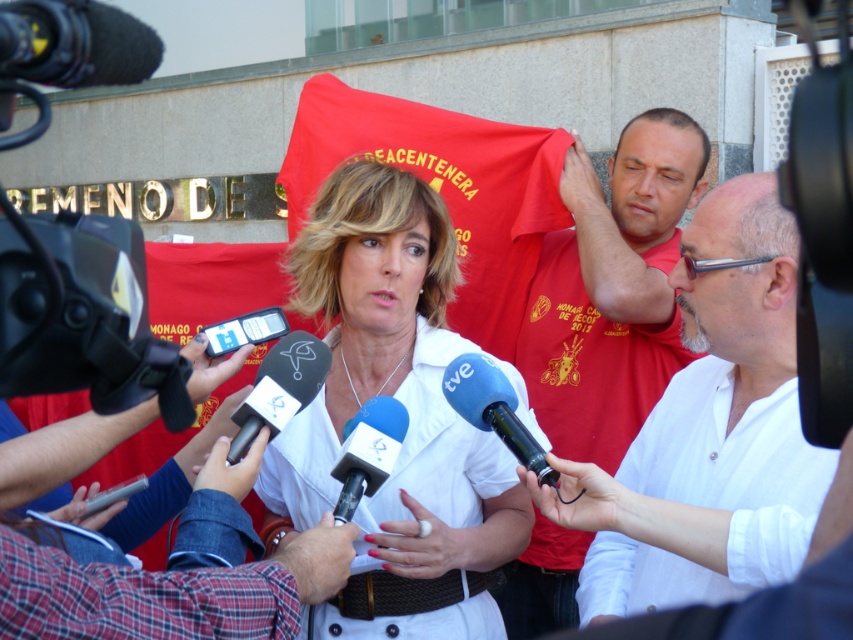
Between point (517, 196) and point (474, 356), which one is positioned behind?

Positioned behind is point (517, 196).

Does point (316, 176) come closer to viewer compared to point (479, 358)?

No, it is not.

Image resolution: width=853 pixels, height=640 pixels. I want to click on red fabric flag at center, so click(444, 188).

Does blue rubberized microphone at center appear on the right side of black plastic media at center?

Correct, you'll find blue rubberized microphone at center to the right of black plastic media at center.

Does blue rubberized microphone at center come in front of black plastic media at center?

Yes, blue rubberized microphone at center is closer to the viewer.

This screenshot has height=640, width=853. Find the location of `blue rubberized microphone at center`. blue rubberized microphone at center is located at coordinates (492, 410).

Between point (384, 636) and point (285, 321), which one is positioned behind?

Point (285, 321)

The height and width of the screenshot is (640, 853). Describe the element at coordinates (404, 404) in the screenshot. I see `white matte shirt at center` at that location.

The width and height of the screenshot is (853, 640). In order to click on white matte shirt at center in this screenshot , I will do `click(404, 404)`.